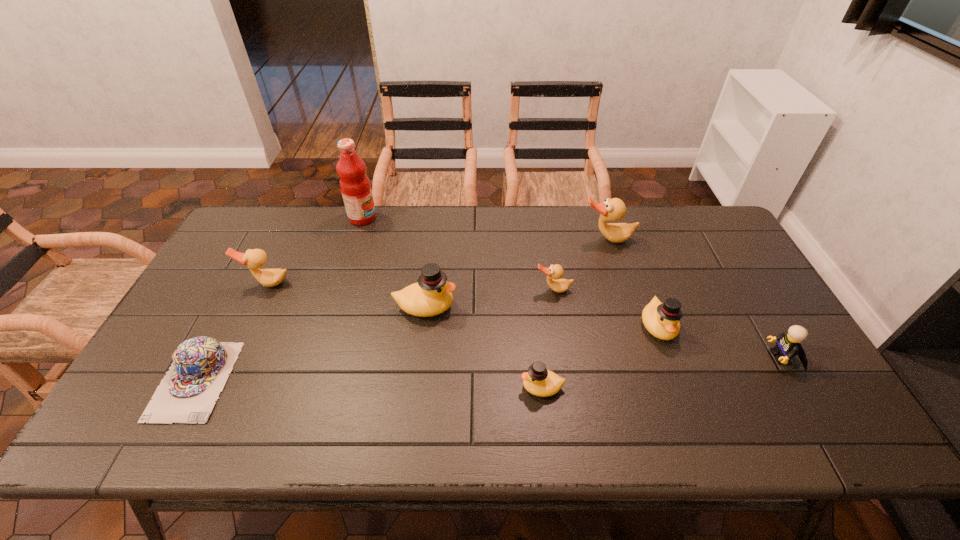
Where is `vacant space located on the front-facing side of the Lego`? This screenshot has width=960, height=540. vacant space located on the front-facing side of the Lego is located at coordinates (666, 357).

Locate an element on the screen. This screenshot has height=540, width=960. free region located 0.360m on the front-facing side of the Lego is located at coordinates (628, 357).

Where is `free space located 0.360m on the beak of the smallest tan duck`? Image resolution: width=960 pixels, height=540 pixels. free space located 0.360m on the beak of the smallest tan duck is located at coordinates (573, 409).

You are a GUI agent. You are given a task and a screenshot of the screen. Output one action in this format:
    pyautogui.click(x=<x>, y=<y>)
    Task: Click on the vacant space located 0.320m on the front-facing side of the nearest yellow duck
    This screenshot has width=960, height=540.
    Given the screenshot: What is the action you would take?
    pyautogui.click(x=388, y=387)

This screenshot has width=960, height=540. I want to click on free space located 0.230m on the front-facing side of the nearest yellow duck, so click(425, 387).

Locate an element on the screen. The width and height of the screenshot is (960, 540). blank space located on the front-facing side of the nearest yellow duck is located at coordinates (396, 387).

Locate an element on the screen. fruit juice located in the far edge section of the desktop is located at coordinates (355, 186).

The image size is (960, 540). I want to click on duck at the far edge, so click(x=614, y=209).

Find the location of a particular element. object that is at the near edge is located at coordinates (200, 366).

Locate an element on the screen. The image size is (960, 540). duck at the left edge is located at coordinates (254, 259).